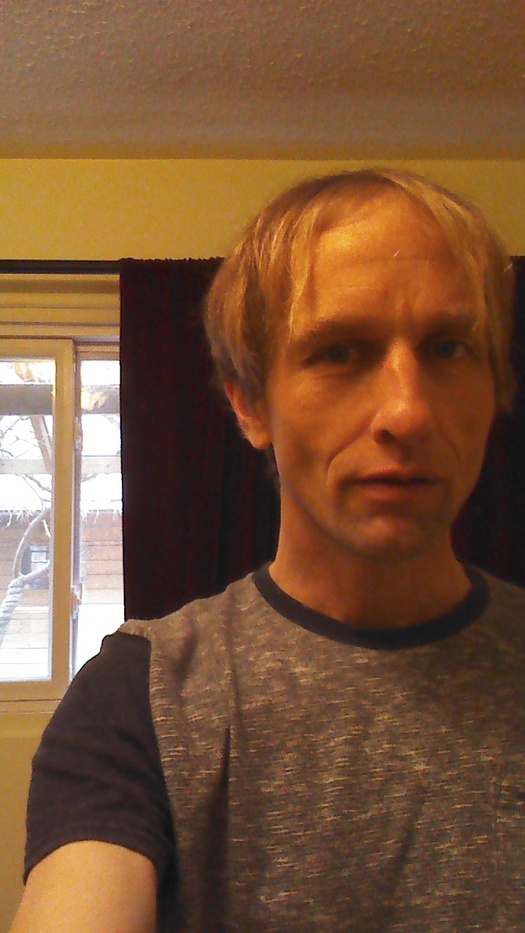
Find the location of `black curtain rod`. black curtain rod is located at coordinates (39, 269).